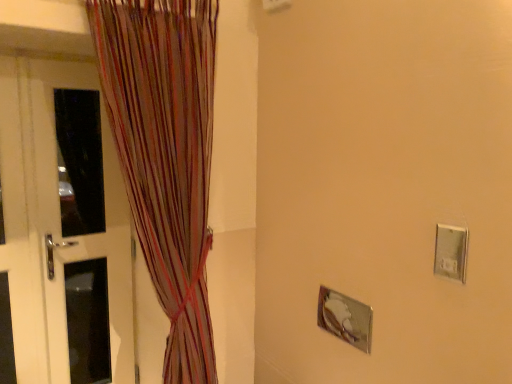
Identify the location of white glossy door at left. (63, 227).

The image size is (512, 384). What do you see at coordinates (451, 252) in the screenshot? I see `silver metallic electric outlet at right` at bounding box center [451, 252].

The image size is (512, 384). I want to click on multicolored striped curtain at left, so click(165, 155).

The image size is (512, 384). What are the coordinates of `white glossy door at left` in the screenshot? It's located at (63, 227).

Which is behind, point (97, 137) or point (159, 8)?

The point (97, 137) is farther.

From the image's perspective, who appears lower, white glossy door at left or multicolored striped curtain at left?

white glossy door at left.

Does white glossy door at left have a greater width compared to multicolored striped curtain at left?

No.

Locate an element on the screen. door located below the silver metallic electric outlet at right (from the image's perspective) is located at coordinates (63, 227).

Is the depth of silver metallic electric outlet at right greater than that of white glossy door at left?

No, it is in front of white glossy door at left.

Is point (462, 241) closer to viewer compared to point (15, 72)?

Yes, point (462, 241) is closer to viewer.

Which of these two, multicolored striped curtain at left or white glossy door at left, is wider?

Wider between the two is multicolored striped curtain at left.

Considering their positions, is multicolored striped curtain at left located in front of or behind white glossy door at left?

multicolored striped curtain at left is positioned closer to the viewer than white glossy door at left.

Based on the photo, is multicolored striped curtain at left taller or shorter than white glossy door at left?

In the image, multicolored striped curtain at left appears to be taller than white glossy door at left.

Which is more to the right, multicolored striped curtain at left or white glossy door at left?

From the viewer's perspective, multicolored striped curtain at left appears more on the right side.

Considering the points (451, 270) and (202, 68), which point is behind, point (451, 270) or point (202, 68)?

Positioned behind is point (202, 68).

Find the location of a particular element. This screenshot has height=384, width=512. electric outlet located in front of the multicolored striped curtain at left is located at coordinates (451, 252).

From a real-world perspective, is silver metallic electric outlet at right over multicolored striped curtain at left?

Yes, from a real-world perspective, silver metallic electric outlet at right is on top of multicolored striped curtain at left.

Are silver metallic electric outlet at right and multicolored striped curtain at left located far from each other?

That's right, there is a large distance between silver metallic electric outlet at right and multicolored striped curtain at left.

Considering the relative sizes of white glossy door at left and silver metallic electric outlet at right in the image provided, is white glossy door at left taller than silver metallic electric outlet at right?

Yes, white glossy door at left is taller than silver metallic electric outlet at right.

Is silver metallic electric outlet at right completely or partially inside white glossy door at left?

No, silver metallic electric outlet at right is not surrounded by white glossy door at left.

In the scene shown: From a real-world perspective, is white glossy door at left positioned above or below silver metallic electric outlet at right?

From a real-world perspective, white glossy door at left is physically below silver metallic electric outlet at right.

From the image's perspective, which one is positioned higher, white glossy door at left or silver metallic electric outlet at right?

silver metallic electric outlet at right, from the image's perspective.

In the image, is multicolored striped curtain at left on the left side or the right side of silver metallic electric outlet at right?

From the image, it's evident that multicolored striped curtain at left is to the left of silver metallic electric outlet at right.

Based on the photo, considering the relative sizes of multicolored striped curtain at left and silver metallic electric outlet at right in the image provided, is multicolored striped curtain at left smaller than silver metallic electric outlet at right?

No, multicolored striped curtain at left is not smaller than silver metallic electric outlet at right.

Locate an element on the screen. door below the multicolored striped curtain at left (from the image's perspective) is located at coordinates (63, 227).

The width and height of the screenshot is (512, 384). I want to click on door below the silver metallic electric outlet at right (from a real-world perspective), so click(63, 227).

Estimate the real-world distances between objects in this image. Which object is further from multicolored striped curtain at left, silver metallic electric outlet at right or white glossy door at left?

The object further to multicolored striped curtain at left is silver metallic electric outlet at right.

When comparing their distances from multicolored striped curtain at left, does white glossy door at left or silver metallic electric outlet at right seem further?

silver metallic electric outlet at right.

Considering their positions, is multicolored striped curtain at left positioned closer to silver metallic electric outlet at right than white glossy door at left?

multicolored striped curtain at left lies closer to silver metallic electric outlet at right than the other object.

Estimate the real-world distances between objects in this image. Which object is closer to white glossy door at left, silver metallic electric outlet at right or multicolored striped curtain at left?

Based on the image, multicolored striped curtain at left appears to be nearer to white glossy door at left.

Consider the image. Which object lies further to the anchor point white glossy door at left, multicolored striped curtain at left or silver metallic electric outlet at right?

The object further to white glossy door at left is silver metallic electric outlet at right.

When comparing their distances from silver metallic electric outlet at right, does white glossy door at left or multicolored striped curtain at left seem closer?

multicolored striped curtain at left lies closer to silver metallic electric outlet at right than the other object.

Image resolution: width=512 pixels, height=384 pixels. Identify the location of curtain between white glossy door at left and silver metallic electric outlet at right in the horizontal direction. (165, 155).